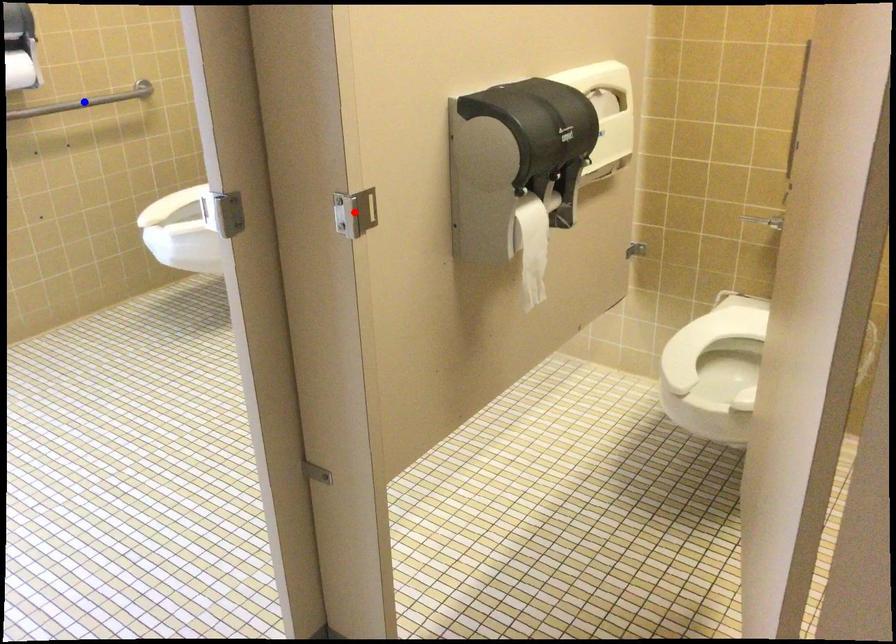
Question: In the image, two points are highlighted. Which point is nearer to the camera? Reply with the corresponding letter.

Choices:
 (A) blue point
 (B) red point

Answer: (B)